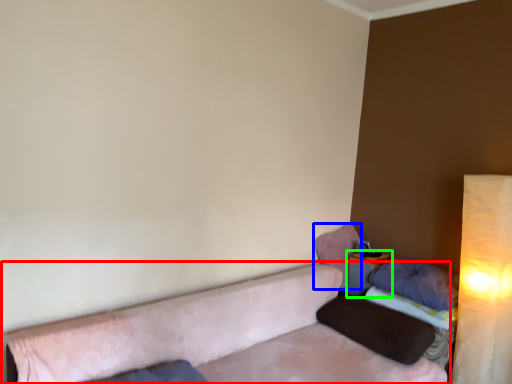
Question: Which object is the closest to the studio couch (highlighted by a red box)? Choose among these: pillow (highlighted by a blue box) or table (highlighted by a green box).

Choices:
 (A) pillow
 (B) table

Answer: (A)